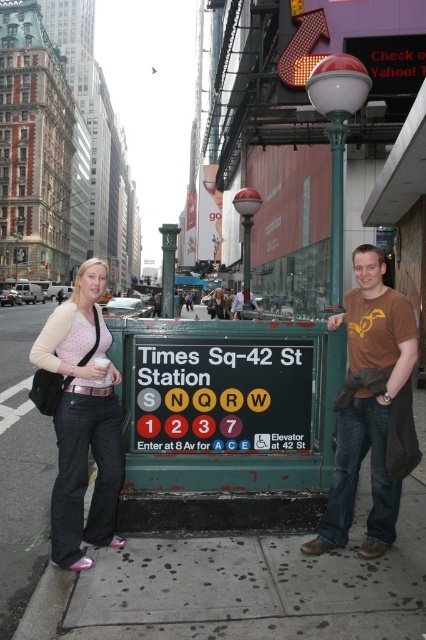
Question: Does metallic silver streetlamp at center have a smaller size compared to metallic pole at center?

Choices:
 (A) yes
 (B) no

Answer: (A)

Question: Among these objects, which one is nearest to the camera?

Choices:
 (A) denim jeans at left
 (B) metallic pole at center
 (C) matte black jacket at center

Answer: (A)

Question: Can you confirm if white glossy streetlight at upper center is positioned to the left of matte black jacket at center?

Choices:
 (A) yes
 (B) no

Answer: (B)

Question: Which point is closer to the camera?

Choices:
 (A) black plastic sign at center
 (B) matte pink shirt at center
 (C) green concrete pavement at center

Answer: (C)

Question: Estimate the real-world distances between objects in this image. Which object is closer to the black plastic sign at center?

Choices:
 (A) white glossy streetlight at upper center
 (B) metallic silver streetlamp at center
 (C) matte pink shirt at center

Answer: (A)

Question: Where is black plastic sign at center located in relation to metallic pole at center in the image?

Choices:
 (A) left
 (B) right

Answer: (B)